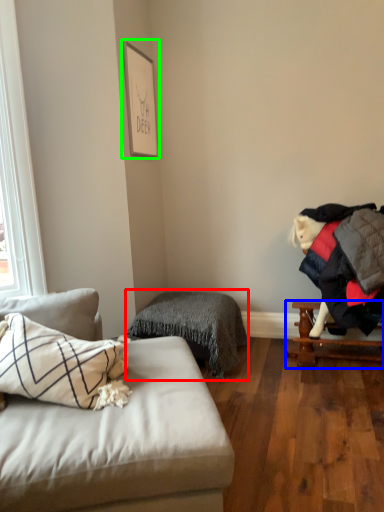
Question: Considering the real-world distances, which object is farthest from bedding (highlighted by a red box)? table (highlighted by a blue box) or picture frame (highlighted by a green box)?

Choices:
 (A) table
 (B) picture frame

Answer: (B)